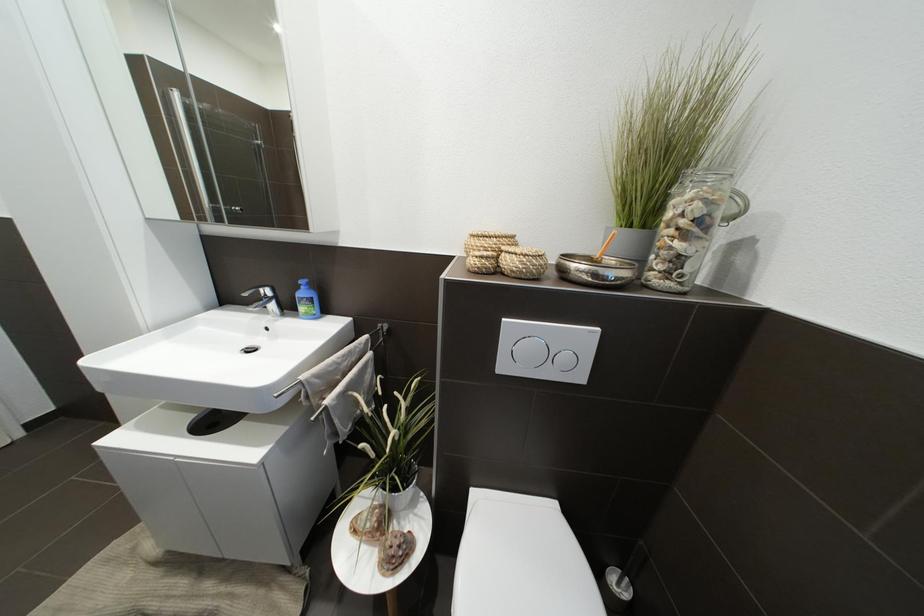
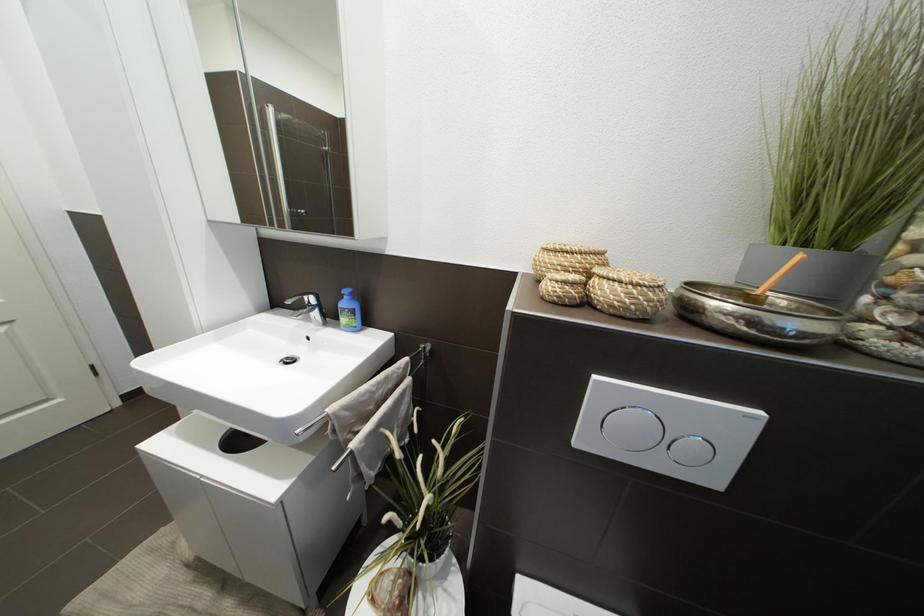
What movement of the cameraman would produce the second image?

The movement direction of the cameraman is left, forward.